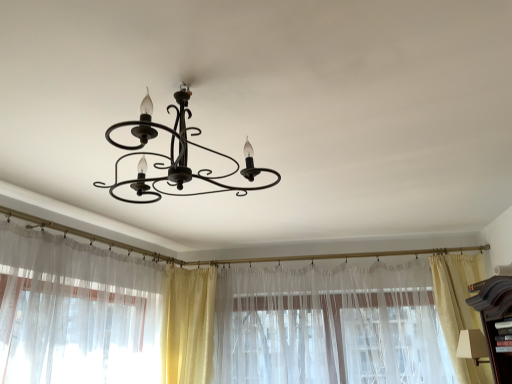
Question: Can you confirm if sheer white curtain at left, the 4th curtain positioned from the right, is smaller than translucent fabric curtain at center, the 2th curtain when ordered from right to left?

Choices:
 (A) yes
 (B) no

Answer: (A)

Question: Are sheer white curtain at left, the 4th curtain positioned from the right, and translucent fabric curtain at center, the third curtain in the left-to-right sequence, making contact?

Choices:
 (A) no
 (B) yes

Answer: (A)

Question: Is sheer white curtain at left, the 4th curtain positioned from the right, looking in the opposite direction of translucent fabric curtain at center, the third curtain in the left-to-right sequence?

Choices:
 (A) no
 (B) yes

Answer: (A)

Question: Considering the relative sizes of sheer white curtain at left, the 4th curtain positioned from the right, and translucent fabric curtain at center, the third curtain in the left-to-right sequence, in the image provided, is sheer white curtain at left, the 4th curtain positioned from the right, shorter than translucent fabric curtain at center, the third curtain in the left-to-right sequence,?

Choices:
 (A) no
 (B) yes

Answer: (B)

Question: Is sheer white curtain at left, arranged as the first curtain when viewed from the left, in front of translucent fabric curtain at center, the third curtain in the left-to-right sequence?

Choices:
 (A) no
 (B) yes

Answer: (B)

Question: Is silky yellow curtain at center, which is counted as the second curtain, starting from the left, taller or shorter than beige sheer curtain at right, placed as the 1th curtain when sorted from right to left?

Choices:
 (A) short
 (B) tall

Answer: (A)

Question: From the image's perspective, is silky yellow curtain at center, which appears as the third curtain when viewed from the right, above or below beige sheer curtain at right, placed as the 1th curtain when sorted from right to left?

Choices:
 (A) below
 (B) above

Answer: (A)

Question: In the image, is silky yellow curtain at center, which is counted as the second curtain, starting from the left, on the left side or the right side of beige sheer curtain at right, the fourth curtain when ordered from left to right?

Choices:
 (A) right
 (B) left

Answer: (B)

Question: Is silky yellow curtain at center, which appears as the third curtain when viewed from the right, wider or thinner than beige sheer curtain at right, the fourth curtain when ordered from left to right?

Choices:
 (A) thin
 (B) wide

Answer: (B)

Question: Considering the positions of sheer white curtain at left, arranged as the first curtain when viewed from the left, and translucent fabric curtain at center, the third curtain in the left-to-right sequence, in the image, is sheer white curtain at left, arranged as the first curtain when viewed from the left, bigger or smaller than translucent fabric curtain at center, the third curtain in the left-to-right sequence,?

Choices:
 (A) small
 (B) big

Answer: (A)

Question: Visually, is sheer white curtain at left, the 4th curtain positioned from the right, positioned to the left or to the right of translucent fabric curtain at center, the third curtain in the left-to-right sequence?

Choices:
 (A) right
 (B) left

Answer: (B)

Question: Is point (42, 365) closer or farther from the camera than point (343, 269)?

Choices:
 (A) farther
 (B) closer

Answer: (B)

Question: Considering their positions, is sheer white curtain at left, arranged as the first curtain when viewed from the left, located in front of or behind translucent fabric curtain at center, the third curtain in the left-to-right sequence?

Choices:
 (A) behind
 (B) front

Answer: (B)

Question: Is beige sheer curtain at right, the fourth curtain when ordered from left to right, situated inside sheer white curtain at left, arranged as the first curtain when viewed from the left, or outside?

Choices:
 (A) outside
 (B) inside

Answer: (A)

Question: From a real-world perspective, is beige sheer curtain at right, placed as the 1th curtain when sorted from right to left, positioned above or below sheer white curtain at left, the 4th curtain positioned from the right?

Choices:
 (A) above
 (B) below

Answer: (B)